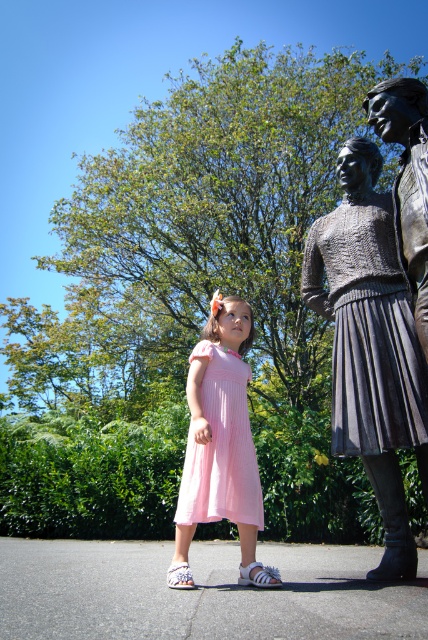
Question: Does bronze statue at right appear on the right side of bronze statue at upper right?

Choices:
 (A) no
 (B) yes

Answer: (B)

Question: Which is farther from the bronze statue at right?

Choices:
 (A) bronze statue at upper right
 (B) pink pleated dress at center

Answer: (B)

Question: In this image, where is bronze statue at right located relative to pink pleated dress at center?

Choices:
 (A) right
 (B) left

Answer: (A)

Question: Which of the following is the closest to the observer?

Choices:
 (A) (425, 115)
 (B) (231, 481)

Answer: (A)

Question: Does bronze statue at right appear on the right side of bronze statue at upper right?

Choices:
 (A) yes
 (B) no

Answer: (A)

Question: Which point appears closest to the camera in this image?

Choices:
 (A) (386, 384)
 (B) (202, 484)

Answer: (A)